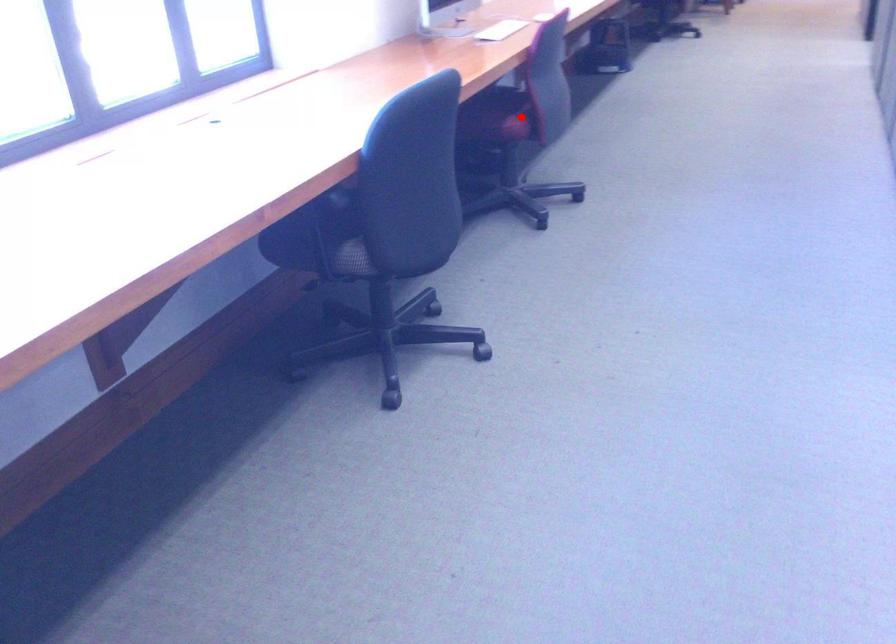
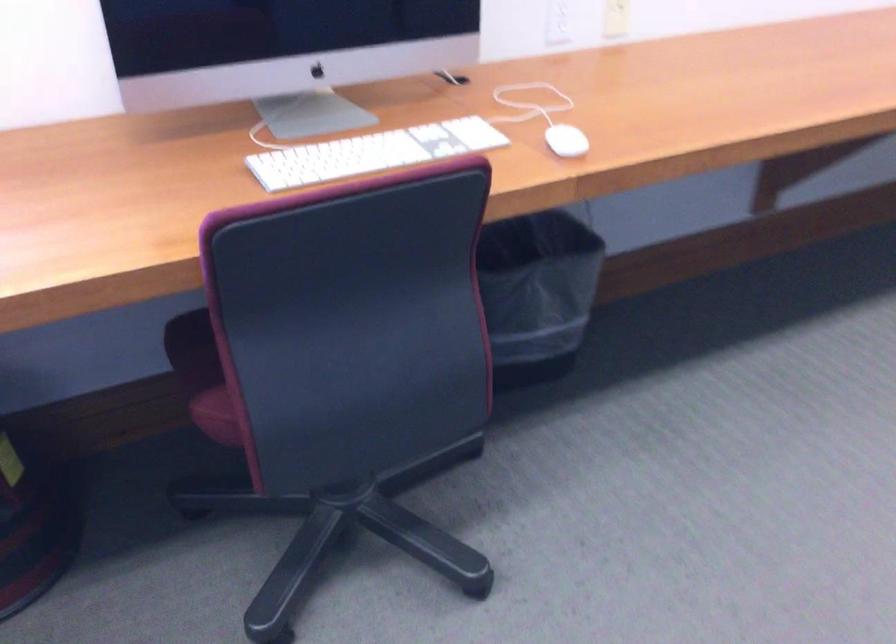
Question: I am providing you with two images of the same scene from different viewpoints. Given a red point in image1, look at the same physical point in image2. Is it:

Choices:
 (A) Closer to the viewpoint
 (B) Farther from the viewpoint

Answer: (A)